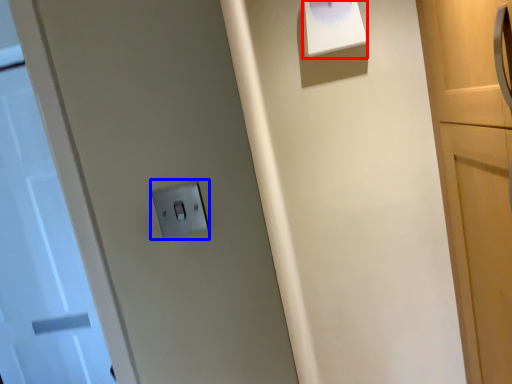
Question: Which point is closer to the camera, wide (highlighted by a red box) or light switch (highlighted by a blue box)?

Choices:
 (A) wide
 (B) light switch

Answer: (B)